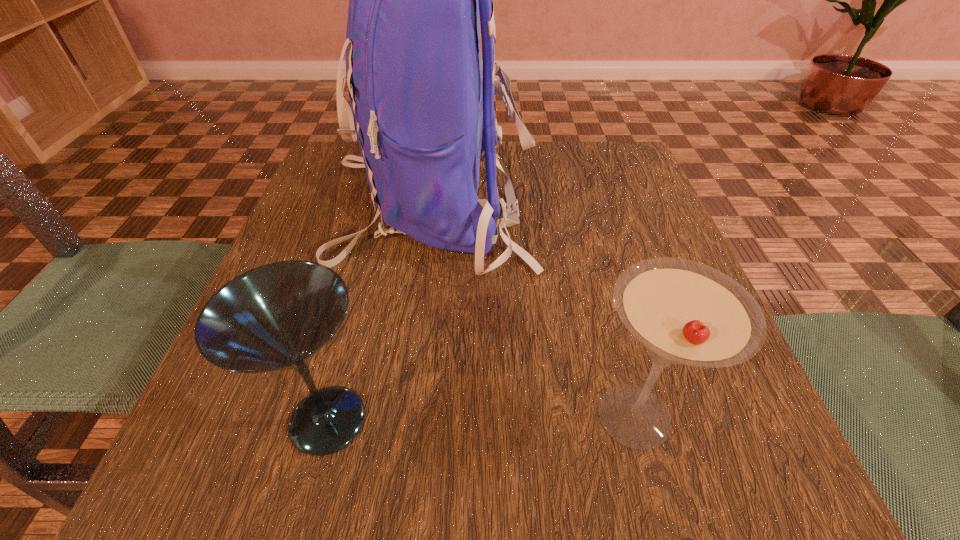
The image size is (960, 540). In order to click on unoccupied area between the left martini and the right martini in this screenshot , I will do `click(481, 418)`.

The height and width of the screenshot is (540, 960). What are the coordinates of `vacant region between the farthest object and the left martini` in the screenshot? It's located at (379, 313).

In order to click on free space that is in between the left martini and the rightmost object in this screenshot , I will do `click(481, 418)`.

The height and width of the screenshot is (540, 960). I want to click on free space between the farthest object and the left martini, so click(379, 313).

You are a GUI agent. You are given a task and a screenshot of the screen. Output one action in this format:
    pyautogui.click(x=<x>, y=<y>)
    Task: Click on the vacant space in between the left martini and the rightmost object
    This screenshot has width=960, height=540.
    Given the screenshot: What is the action you would take?
    pyautogui.click(x=481, y=418)

Where is `vacant area that lies between the right martini and the tallest object`? vacant area that lies between the right martini and the tallest object is located at coordinates (533, 310).

This screenshot has width=960, height=540. What are the coordinates of `empty space between the right martini and the backpack` in the screenshot? It's located at (533, 310).

The image size is (960, 540). In order to click on vacant space that's between the left martini and the backpack in this screenshot , I will do `click(379, 313)`.

Find the location of a particular element. This screenshot has height=540, width=960. vacant space in between the backpack and the left martini is located at coordinates tap(379, 313).

Where is `object that is the nearest to the backpack`? Image resolution: width=960 pixels, height=540 pixels. object that is the nearest to the backpack is located at coordinates (x=683, y=312).